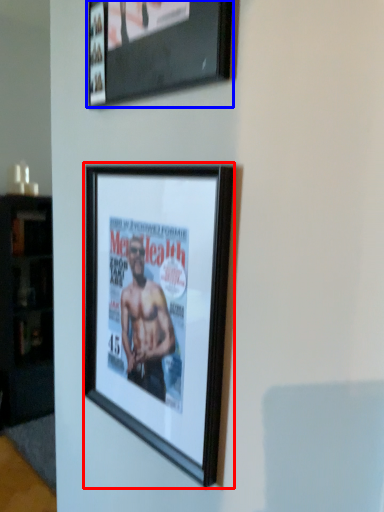
Question: Which object appears closest to the camera in this image, picture frame (highlighted by a red box) or picture frame (highlighted by a blue box)?

Choices:
 (A) picture frame
 (B) picture frame

Answer: (B)